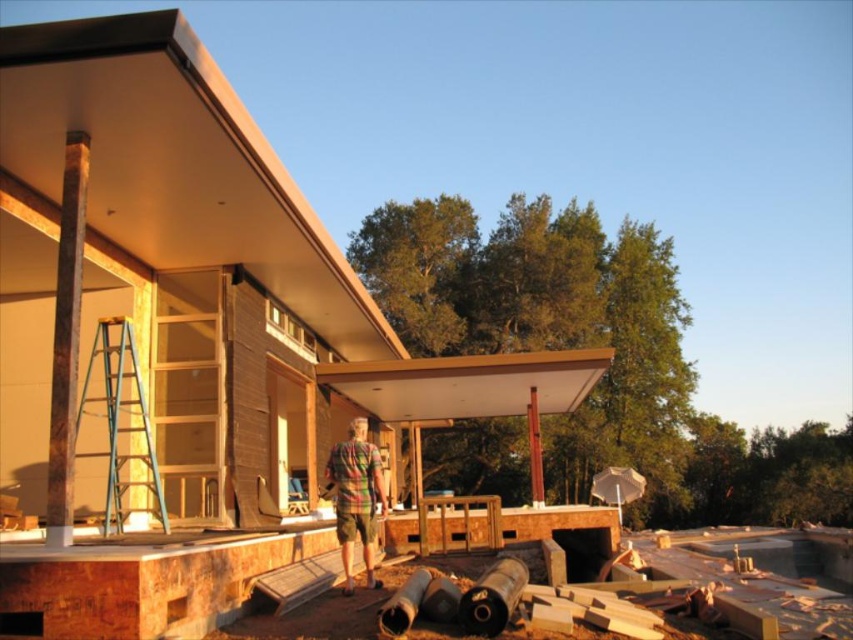
Question: In this image, where is metallic blue ladder at left located relative to plaid fabric shirt at center?

Choices:
 (A) right
 (B) left

Answer: (B)

Question: Can you confirm if metallic blue ladder at left is wider than plaid fabric shirt at center?

Choices:
 (A) no
 (B) yes

Answer: (B)

Question: Which point appears farthest from the camera in this image?

Choices:
 (A) (132, 396)
 (B) (332, 474)

Answer: (A)

Question: Can you confirm if metallic blue ladder at left is positioned below plaid fabric shirt at center?

Choices:
 (A) yes
 (B) no

Answer: (B)

Question: Which object is farther from the camera taking this photo?

Choices:
 (A) plaid fabric shirt at center
 (B) metallic blue ladder at left

Answer: (A)